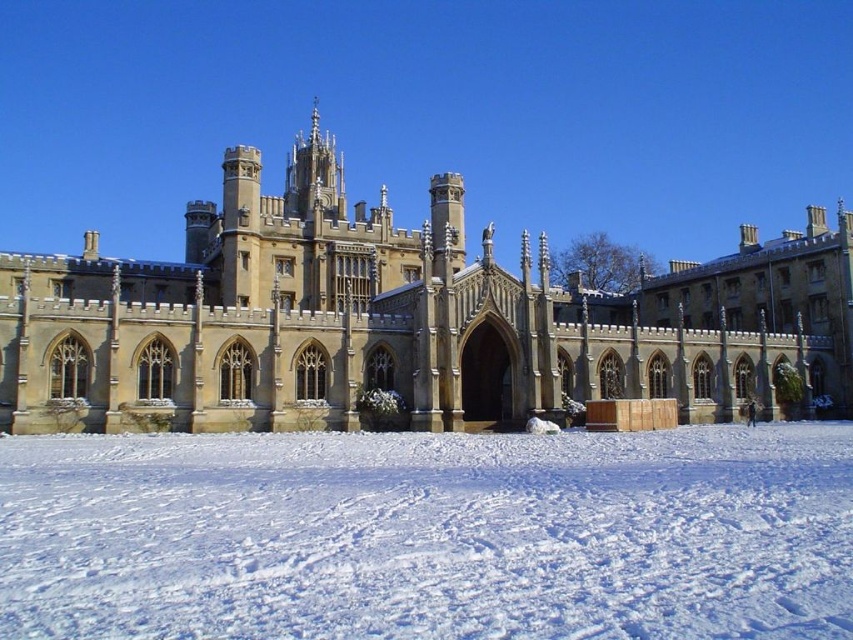
Which is behind, point (807, 442) or point (403, 328)?

Positioned behind is point (403, 328).

Does white powdery snow at lower center lie behind golden stone palace at center?

No, white powdery snow at lower center is in front of golden stone palace at center.

Which is behind, point (503, 484) or point (142, 308)?

Positioned behind is point (142, 308).

The width and height of the screenshot is (853, 640). Find the location of `white powdery snow at lower center`. white powdery snow at lower center is located at coordinates (428, 536).